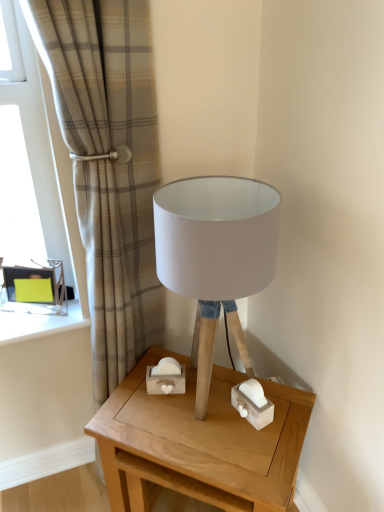
Question: Is green cardboard box at left looking in the opposite direction of wooden table at center?

Choices:
 (A) no
 (B) yes

Answer: (A)

Question: From a real-world perspective, is green cardboard box at left on wooden table at center?

Choices:
 (A) no
 (B) yes

Answer: (B)

Question: Does green cardboard box at left have a larger size compared to wooden table at center?

Choices:
 (A) no
 (B) yes

Answer: (A)

Question: Is green cardboard box at left shorter than wooden table at center?

Choices:
 (A) no
 (B) yes

Answer: (B)

Question: Is green cardboard box at left located outside wooden table at center?

Choices:
 (A) no
 (B) yes

Answer: (B)

Question: In terms of width, does white fabric lampshade at center look wider or thinner when compared to beige plaid curtain at upper left?

Choices:
 (A) thin
 (B) wide

Answer: (B)

Question: In the image, is white fabric lampshade at center positioned in front of or behind beige plaid curtain at upper left?

Choices:
 (A) front
 (B) behind

Answer: (B)

Question: Is white fabric lampshade at center inside or outside of beige plaid curtain at upper left?

Choices:
 (A) outside
 (B) inside

Answer: (A)

Question: From the image's perspective, is white fabric lampshade at center positioned above or below beige plaid curtain at upper left?

Choices:
 (A) below
 (B) above

Answer: (A)

Question: From a real-world perspective, is matte glass window at left physically located above or below wooden table at center?

Choices:
 (A) below
 (B) above

Answer: (B)

Question: From the image's perspective, is matte glass window at left located above or below wooden table at center?

Choices:
 (A) above
 (B) below

Answer: (A)

Question: Considering the positions of matte glass window at left and wooden table at center in the image, is matte glass window at left bigger or smaller than wooden table at center?

Choices:
 (A) big
 (B) small

Answer: (B)

Question: Is matte glass window at left taller or shorter than wooden table at center?

Choices:
 (A) short
 (B) tall

Answer: (B)

Question: In terms of width, does wooden table at center look wider or thinner when compared to beige plaid curtain at upper left?

Choices:
 (A) wide
 (B) thin

Answer: (A)

Question: Considering their positions, is wooden table at center located in front of or behind beige plaid curtain at upper left?

Choices:
 (A) behind
 (B) front

Answer: (A)